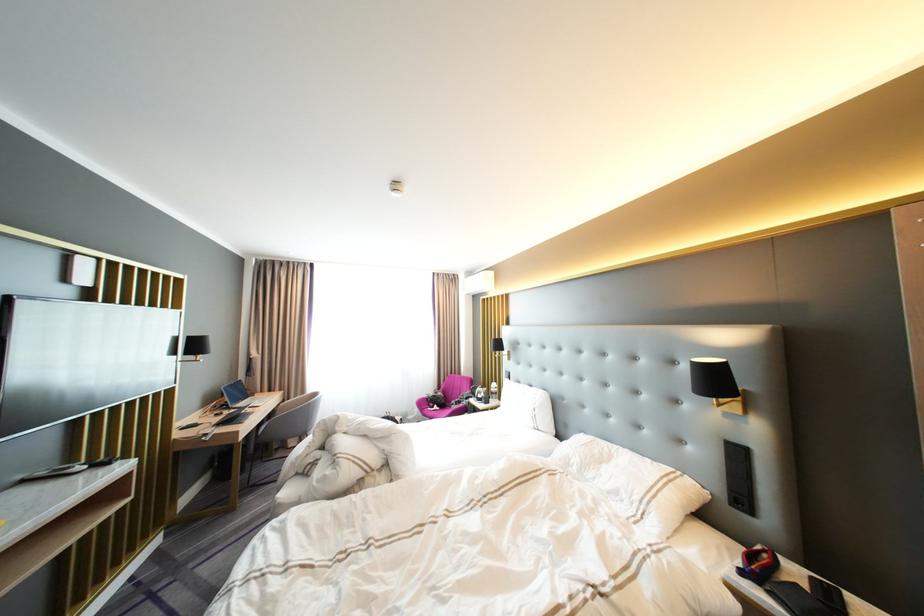
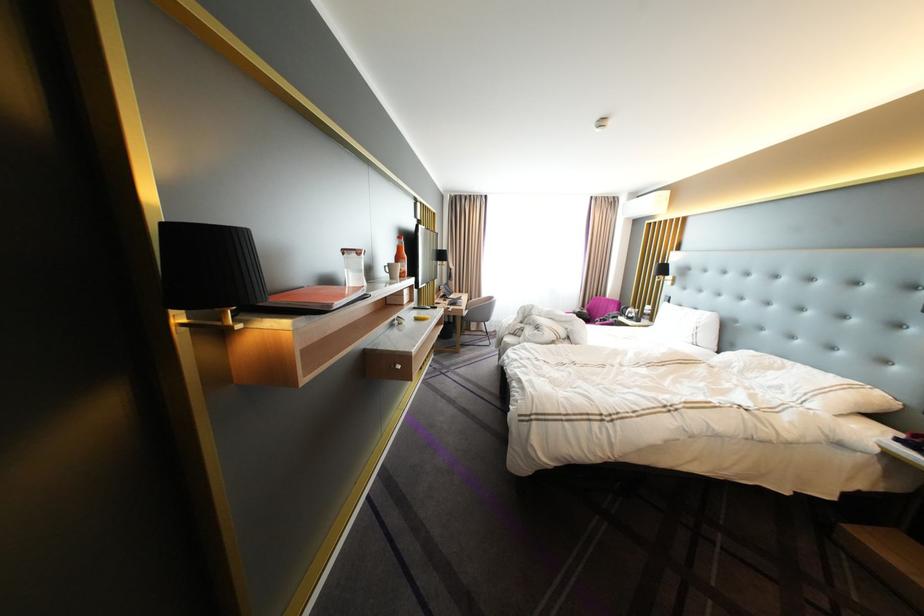
Find the pixel in the second image that matches [478,386] in the first image.

(625, 307)